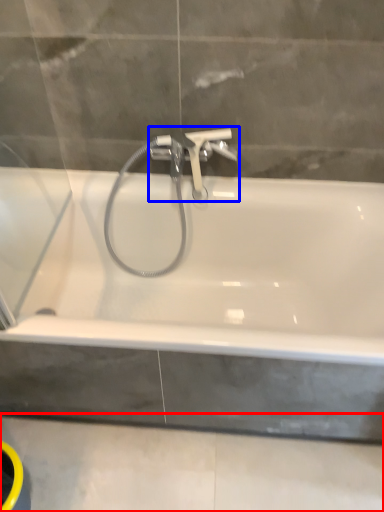
Question: Which of the following is the farthest to the observer, concrete (highlighted by a red box) or tap (highlighted by a blue box)?

Choices:
 (A) concrete
 (B) tap

Answer: (B)